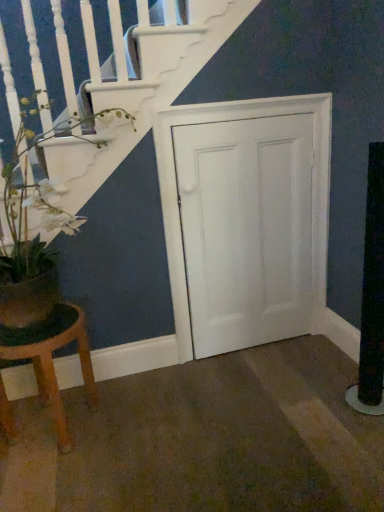
Where is `vacant space in wooden stool at lower left (from a real-world perspective)`? vacant space in wooden stool at lower left (from a real-world perspective) is located at coordinates (52, 423).